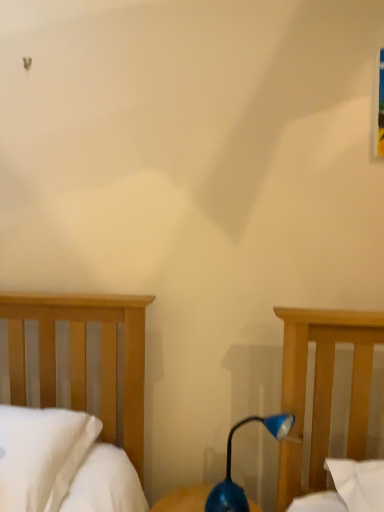
Find the location of a particular element. This screenshot has width=384, height=512. blue plastic lamp at center is located at coordinates point(230,466).

Describe the element at coordinates (230, 466) in the screenshot. The image size is (384, 512). I see `blue plastic lamp at center` at that location.

What is the approximate width of blue plastic lamp at center?

blue plastic lamp at center is 4.48 inches wide.

Find the location of a particular element. This screenshot has width=384, height=512. blue plastic lamp at center is located at coordinates (230, 466).